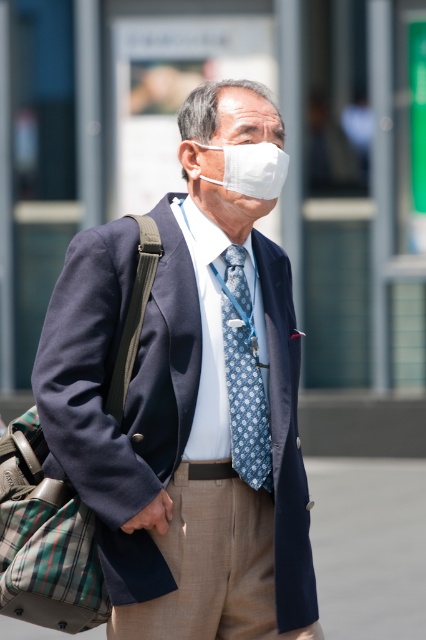
Based on the scene description, which object is taller between the navy wool suit at center and the plaid fabric bag at left?

The navy wool suit at center is much taller than the plaid fabric bag at left.

Based on the photo, you are a photographer trying to capture a clear shot of the man in the navy wool suit at center and the plaid fabric bag at left. Since you want both subjects in focus, which one should you focus on first to ensure depth of field?

The navy wool suit at center is closer to the viewer than the plaid fabric bag at left, so you should focus on the navy wool suit at center first to ensure both are in focus.

Based on the scene description, which object is positioned higher on the man? The navy wool suit at center or the blue dotted tie at center?

The navy wool suit at center is located above the blue dotted tie at center, so the navy wool suit at center is positioned higher on the man.